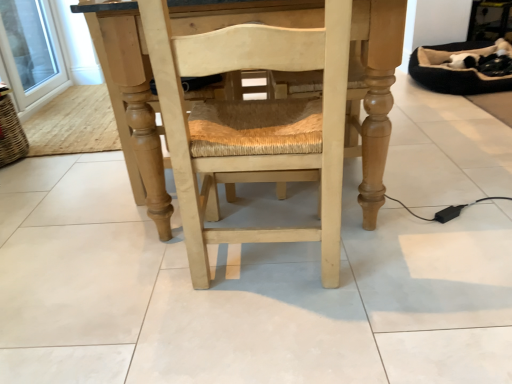
You are a GUI agent. You are given a task and a screenshot of the screen. Output one action in this format:
    pyautogui.click(x=<x>, y=<y>)
    Task: Click on the vacant space in light wood chair at center (from a real-world perspective)
    
    Given the screenshot: What is the action you would take?
    pyautogui.click(x=274, y=273)